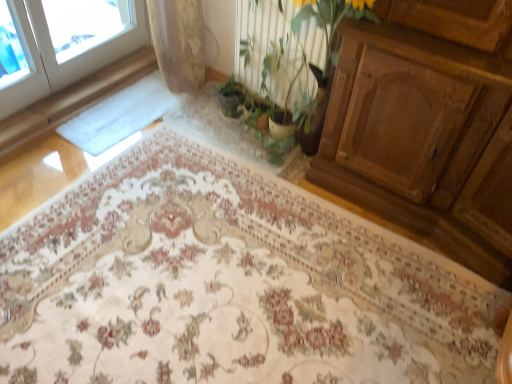
Question: Is floral carpet at center thinner than green matte plant at center?

Choices:
 (A) no
 (B) yes

Answer: (A)

Question: Would you say floral carpet at center is outside green matte plant at center?

Choices:
 (A) no
 (B) yes

Answer: (B)

Question: From a real-world perspective, is floral carpet at center below green matte plant at center?

Choices:
 (A) yes
 (B) no

Answer: (A)

Question: Does floral carpet at center lie behind green matte plant at center?

Choices:
 (A) no
 (B) yes

Answer: (A)

Question: Can you confirm if floral carpet at center is bigger than green matte plant at center?

Choices:
 (A) yes
 (B) no

Answer: (A)

Question: Is floral carpet at center wider than green matte plant at center?

Choices:
 (A) yes
 (B) no

Answer: (A)

Question: From the image's perspective, is green matte plant at center over floral carpet at center?

Choices:
 (A) no
 (B) yes

Answer: (B)

Question: Considering the relative sizes of green matte plant at center and floral carpet at center in the image provided, is green matte plant at center bigger than floral carpet at center?

Choices:
 (A) no
 (B) yes

Answer: (A)

Question: Is green matte plant at center in front of floral carpet at center?

Choices:
 (A) no
 (B) yes

Answer: (A)

Question: Does green matte plant at center have a smaller size compared to floral carpet at center?

Choices:
 (A) no
 (B) yes

Answer: (B)

Question: Considering the relative sizes of green matte plant at center and floral carpet at center in the image provided, is green matte plant at center taller than floral carpet at center?

Choices:
 (A) yes
 (B) no

Answer: (A)

Question: Can you confirm if green matte plant at center is thinner than floral carpet at center?

Choices:
 (A) no
 (B) yes

Answer: (B)

Question: Is floral carpet at center to the right of green leafy plant at center from the viewer's perspective?

Choices:
 (A) yes
 (B) no

Answer: (B)